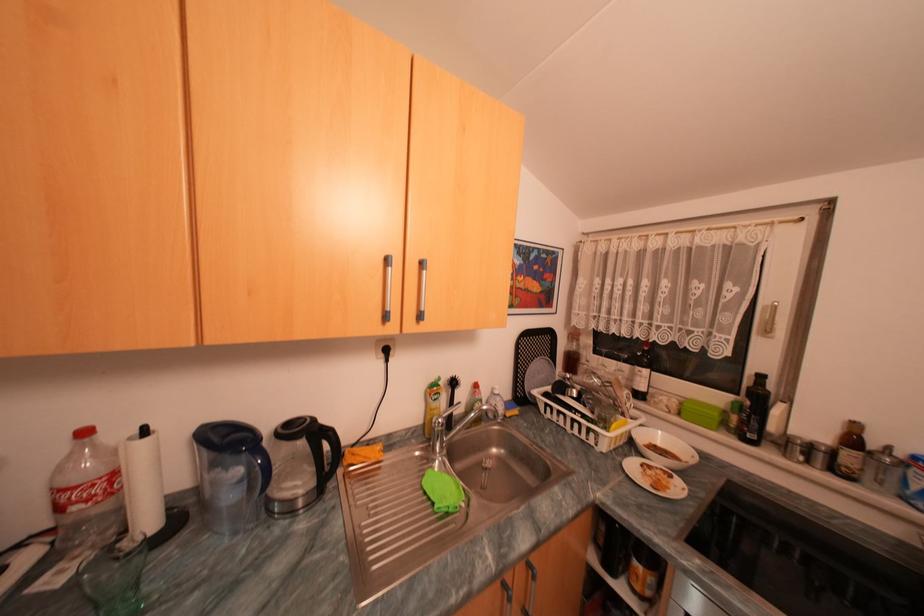
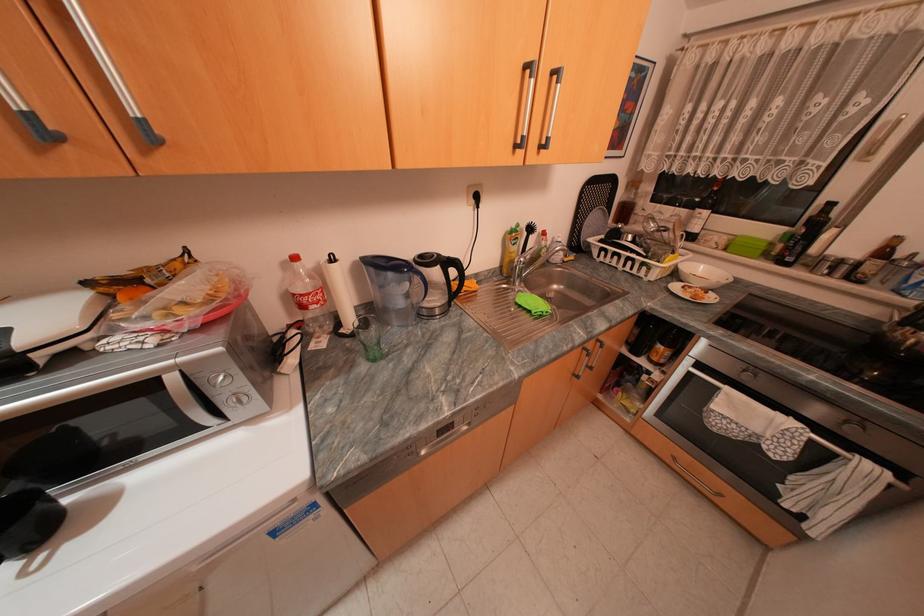
In the second image, find the point that corresponds to the point at 427,454 in the first image.

(514, 285)